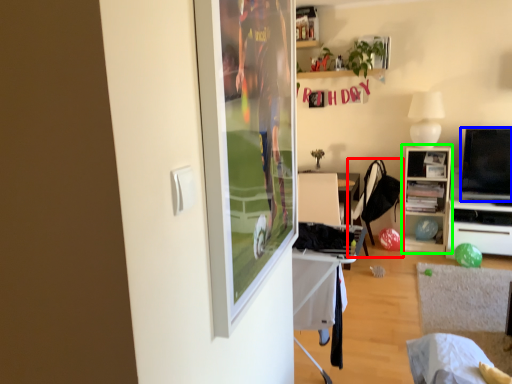
Question: Which object is positioned closest to chair (highlighted by a red box)? Select from television (highlighted by a blue box) and cabinetry (highlighted by a green box).

Choices:
 (A) television
 (B) cabinetry

Answer: (B)